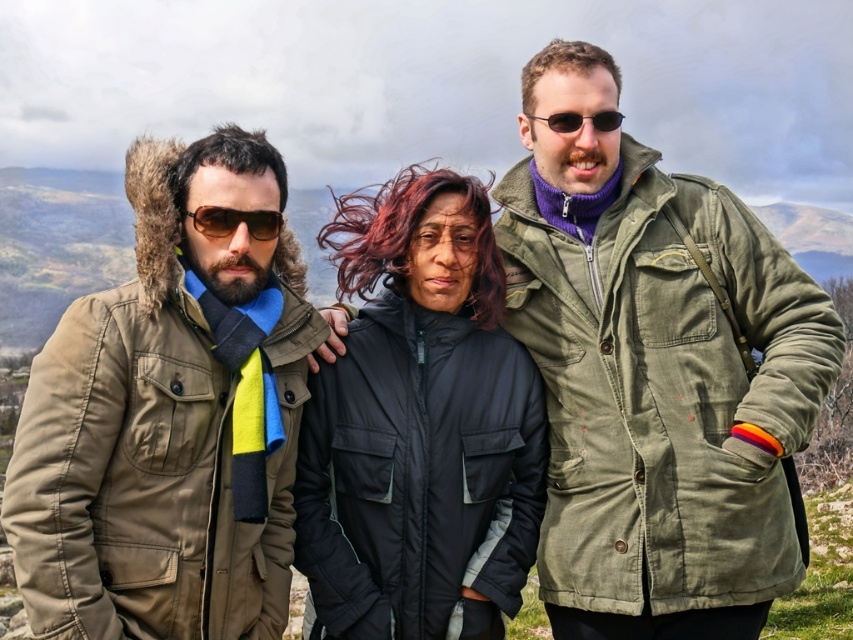
Based on the scene description, which object is located at the coordinates point (169,417)?

The point (169,417) corresponds to the khaki fabric jacket at left.

From the picture: You are a photographer trying to capture a clear shot of the khaki fabric jacket at left and the matte brown sunglasses at center. Since you want both items to be in focus, which one should you adjust your camera focus on first to ensure the closest object is sharp?

The khaki fabric jacket at left is closer to the viewer than the matte brown sunglasses at center, so you should focus on the khaki fabric jacket at left first to ensure depth of field captures both items.